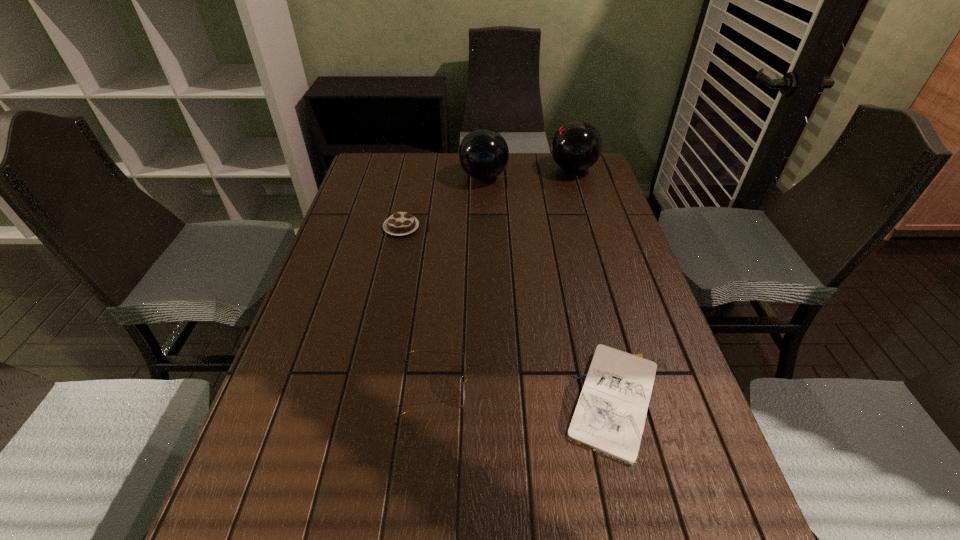
You are a GUI agent. You are given a task and a screenshot of the screen. Output one action in this format:
    pyautogui.click(x=<x>, y=<y>)
    Task: Click on the right bowling ball
    This screenshot has width=960, height=540.
    Given the screenshot: What is the action you would take?
    pyautogui.click(x=576, y=146)

Locate an element on the screen. The height and width of the screenshot is (540, 960). the left bowling ball is located at coordinates (483, 154).

You are a GUI agent. You are given a task and a screenshot of the screen. Output one action in this format:
    pyautogui.click(x=<x>, y=<y>)
    Task: Click on the third shortest object
    
    Given the screenshot: What is the action you would take?
    pyautogui.click(x=417, y=350)

Where is `the leftmost object`? the leftmost object is located at coordinates [x=400, y=223].

Find the location of a particular element. chocolate cake is located at coordinates (400, 223).

The width and height of the screenshot is (960, 540). In order to click on the shortest object in this screenshot , I will do `click(609, 417)`.

Where is `vacant space located 0.290m on the surface of the right bowling ball near the finger holes`? vacant space located 0.290m on the surface of the right bowling ball near the finger holes is located at coordinates [x=469, y=170].

The image size is (960, 540). I want to click on vacant space positioned on the surface of the right bowling ball near the finger holes, so click(x=516, y=170).

The width and height of the screenshot is (960, 540). What are the coordinates of `free space located on the surface of the right bowling ball near the finger holes` in the screenshot? It's located at (508, 170).

This screenshot has height=540, width=960. Find the location of `free region located on the side of the left bowling ball with the finger holes`. free region located on the side of the left bowling ball with the finger holes is located at coordinates (356, 177).